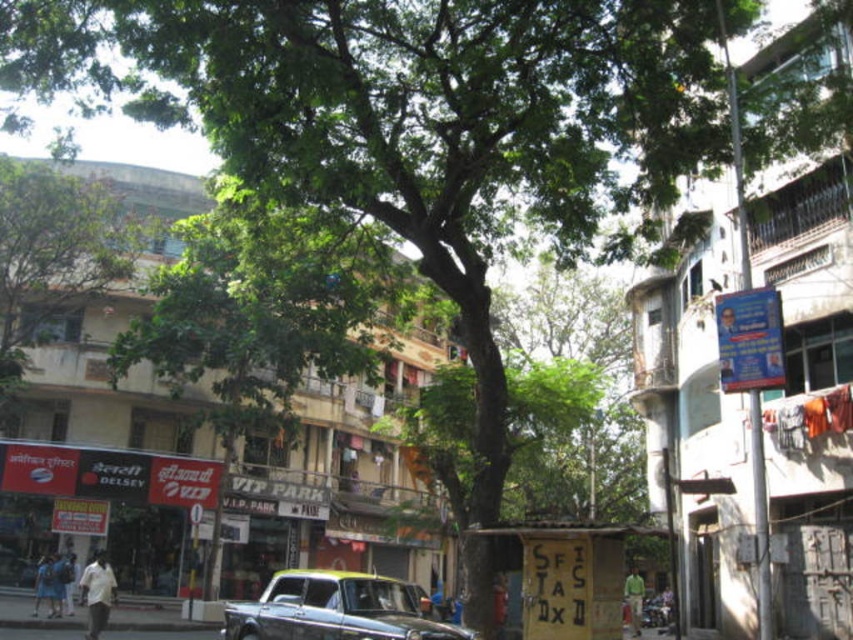
Question: Is green leafy tree at center further to the viewer compared to metallic gray car at center?

Choices:
 (A) no
 (B) yes

Answer: (B)

Question: Can you confirm if green leafy tree at center is thinner than metallic gray car at center?

Choices:
 (A) yes
 (B) no

Answer: (B)

Question: Which object is closer to the camera taking this photo?

Choices:
 (A) metallic gray car at center
 (B) green leafy tree at center

Answer: (A)

Question: Does green leafy tree at center appear on the right side of metallic gray car at center?

Choices:
 (A) yes
 (B) no

Answer: (B)